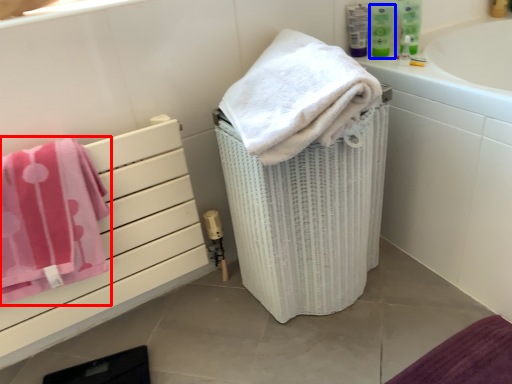
Question: Which of the following is the closest to the observer, towel (highlighted by a red box) or mouthwash (highlighted by a blue box)?

Choices:
 (A) towel
 (B) mouthwash

Answer: (A)